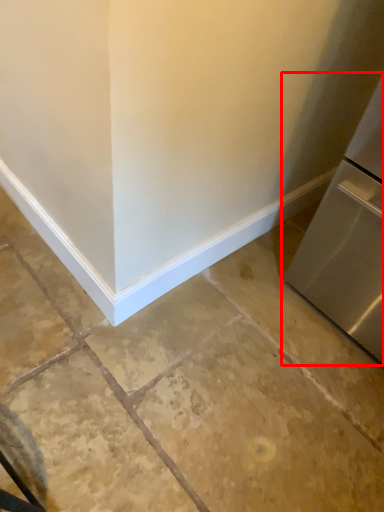
Question: From the image's perspective, where is refrigerator (annotated by the red box) located in relation to concrete in the image?

Choices:
 (A) below
 (B) above

Answer: (B)